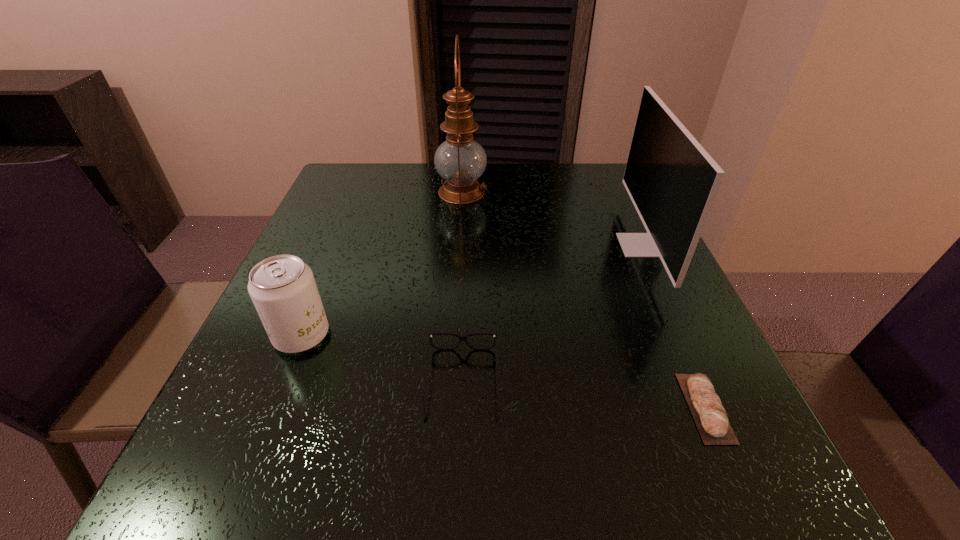
I want to click on oil lamp, so click(460, 160).

Find the location of a particular element. Image resolution: width=960 pixels, height=540 pixels. the second tallest object is located at coordinates (672, 181).

Find the location of a particular element. The width and height of the screenshot is (960, 540). soda can is located at coordinates (283, 289).

Where is `the leftmost object`? This screenshot has height=540, width=960. the leftmost object is located at coordinates (283, 289).

Where is `spectacles`? The height and width of the screenshot is (540, 960). spectacles is located at coordinates (461, 337).

This screenshot has width=960, height=540. In order to click on the shortest object in this screenshot , I will do `click(710, 417)`.

The width and height of the screenshot is (960, 540). Identify the location of blank space located on the right of the tallest object. (612, 192).

Image resolution: width=960 pixels, height=540 pixels. I want to click on vacant space located on the front-facing side of the monitor, so click(443, 245).

Where is `vacant area situated 0.050m on the front-facing side of the monitor`? vacant area situated 0.050m on the front-facing side of the monitor is located at coordinates (598, 245).

Locate an element on the screen. This screenshot has height=540, width=960. vacant space located on the front-facing side of the monitor is located at coordinates (557, 245).